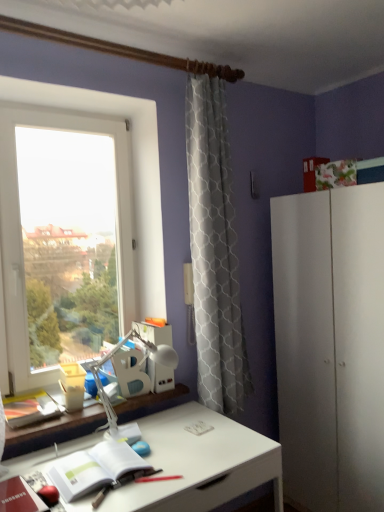
I want to click on vacant area to the right of white paper notebook at lower left, so click(177, 468).